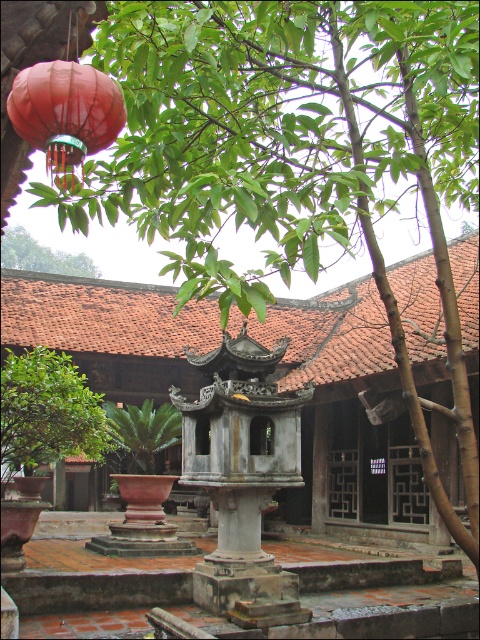
You are standing in the courtyard and want to take a photo of the green leafy tree at lower left. If your camera has a maximum focus range of 40 feet, will you need to move closer to capture it clearly?

The green leafy tree at lower left is 43.81 feet away from the camera, which exceeds the maximum focus range of 40 feet. To capture it clearly, you need to move closer so that the distance is within 40 feet.

You are standing in the courtyard and want to hang a new decoration. The matte red lantern at upper left is in your way. Can you move it to access the green leafy plant at center?

The matte red lantern at upper left is closer to the viewer than the green leafy plant at center, so moving it would allow you to access the green leafy plant at center.